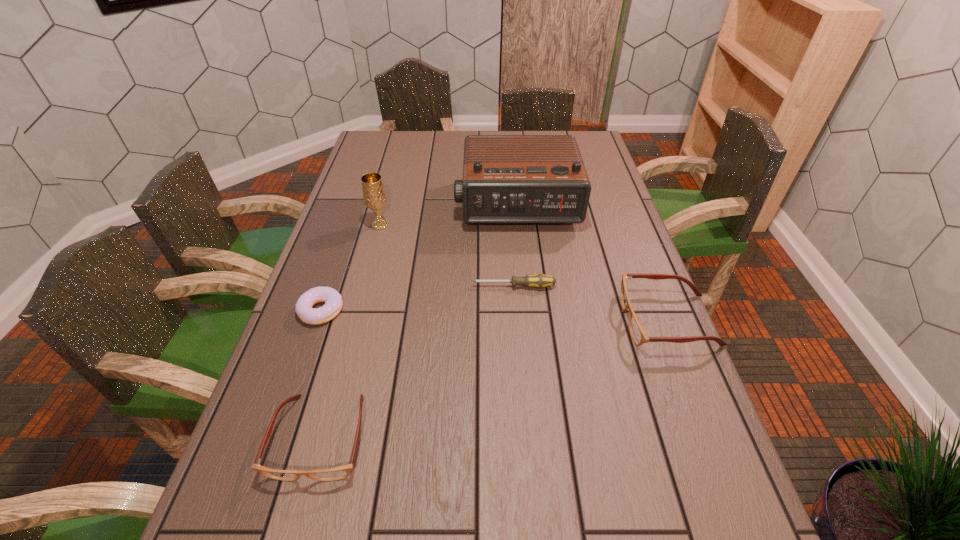
Locate an element on the screen. Image resolution: width=960 pixels, height=540 pixels. blank region between the fourth shortest object and the doughnut is located at coordinates (494, 315).

The image size is (960, 540). Find the location of `free spot between the doughnut and the screwdriver`. free spot between the doughnut and the screwdriver is located at coordinates (418, 299).

Identify the location of free area in between the doughnut and the tallest object. (419, 258).

Where is `free space between the fifth shortest object and the tallest object`? This screenshot has height=540, width=960. free space between the fifth shortest object and the tallest object is located at coordinates (448, 215).

Image resolution: width=960 pixels, height=540 pixels. Find the location of `vacant area that lies between the fifth shortest object and the shorter spectacles`. vacant area that lies between the fifth shortest object and the shorter spectacles is located at coordinates (350, 331).

This screenshot has width=960, height=540. In order to click on vacant area between the second tallest object and the radio receiver in this screenshot , I will do [x=448, y=215].

The image size is (960, 540). I want to click on free spot between the screwdriver and the left spectacles, so click(417, 362).

Where is `vacant area that lies between the tallest object and the taller spectacles`? This screenshot has width=960, height=540. vacant area that lies between the tallest object and the taller spectacles is located at coordinates (592, 262).

Find the location of `unoccupied position between the screwdriver and the third shortest object`. unoccupied position between the screwdriver and the third shortest object is located at coordinates point(417,362).

At what (x,y) coordinates should I click in order to perform the action: click on free space between the nearer spectacles and the radio receiver. Please return your answer as a coordinate pair (x, y). Image resolution: width=960 pixels, height=540 pixels. Looking at the image, I should click on (419, 321).